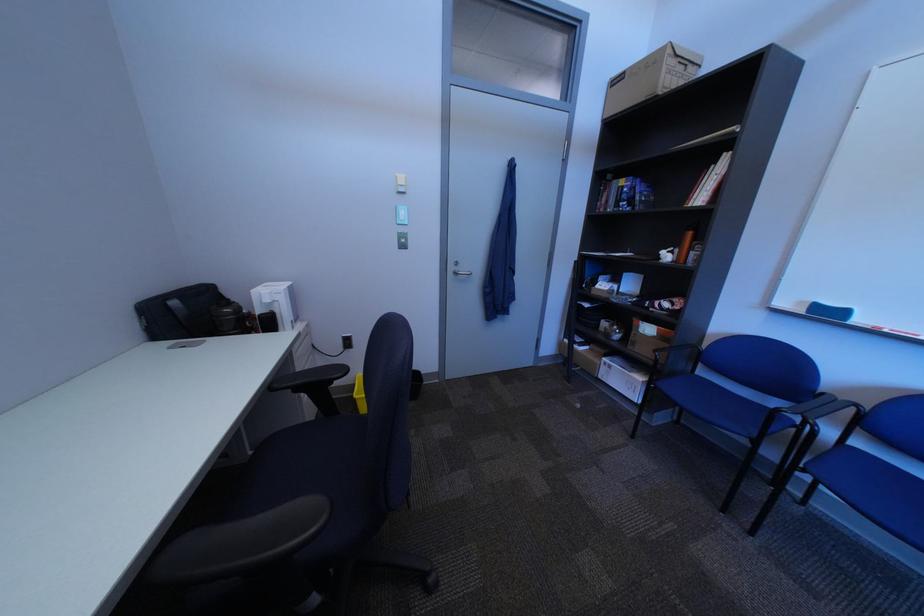
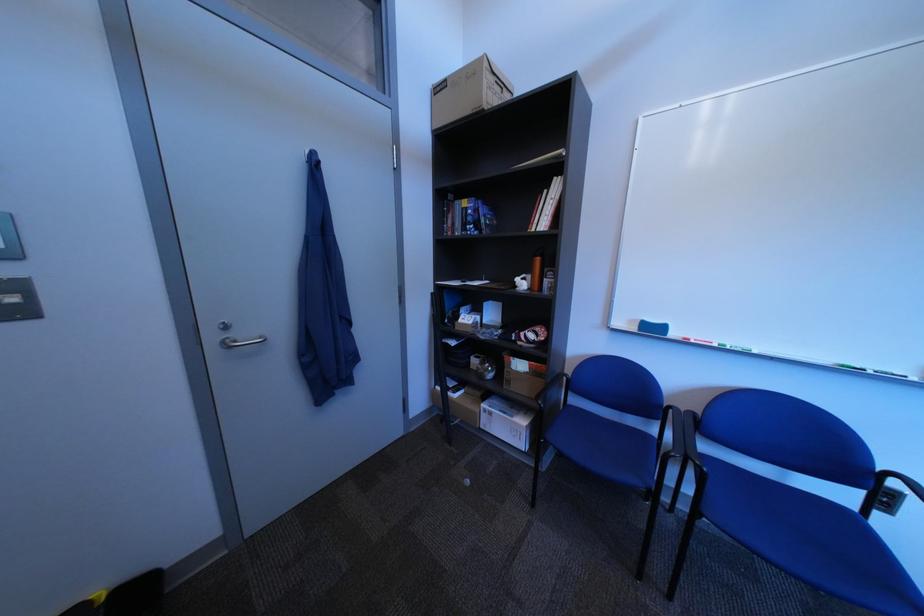
Locate, in the second image, the point that corresponds to the point at 650,345 in the first image.

(525, 383)